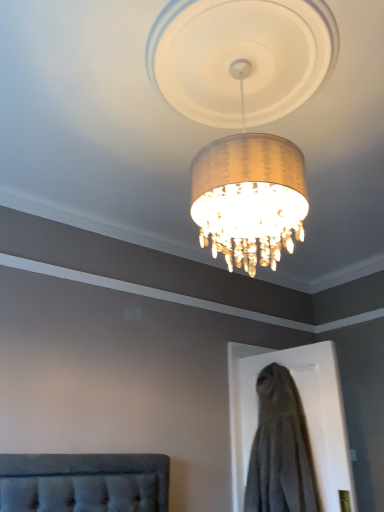
Question: From a real-world perspective, is gray fabric dress at lower right positioned above or below gold textured lampshade at center?

Choices:
 (A) below
 (B) above

Answer: (A)

Question: From the image's perspective, relative to gold textured lampshade at center, is gray fabric dress at lower right above or below?

Choices:
 (A) above
 (B) below

Answer: (B)

Question: Considering the positions of gray fabric dress at lower right and gold textured lampshade at center in the image, is gray fabric dress at lower right wider or thinner than gold textured lampshade at center?

Choices:
 (A) thin
 (B) wide

Answer: (A)

Question: From a real-world perspective, is gold textured lampshade at center above or below gray fabric dress at lower right?

Choices:
 (A) above
 (B) below

Answer: (A)

Question: Would you say gold textured lampshade at center is to the left or to the right of gray fabric dress at lower right in the picture?

Choices:
 (A) left
 (B) right

Answer: (A)

Question: In terms of height, does gold textured lampshade at center look taller or shorter compared to gray fabric dress at lower right?

Choices:
 (A) tall
 (B) short

Answer: (B)

Question: From the image's perspective, is gold textured lampshade at center positioned above or below gray fabric dress at lower right?

Choices:
 (A) above
 (B) below

Answer: (A)